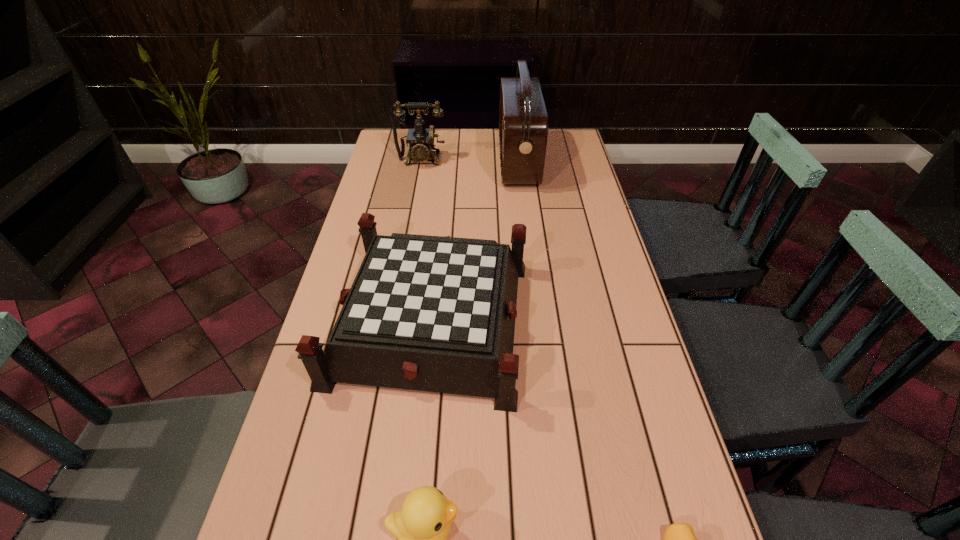
The image size is (960, 540). I want to click on the tallest object, so click(523, 121).

What are the coordinates of `the second tallest object` in the screenshot? It's located at (420, 140).

In order to click on the third shortest object in this screenshot , I will do `click(429, 313)`.

Identify the location of checkerboard. Image resolution: width=960 pixels, height=540 pixels. (429, 313).

Find the location of a particular element. The height and width of the screenshot is (540, 960). vacant space located 0.360m on the front panel of the tallest object is located at coordinates [403, 163].

This screenshot has width=960, height=540. I want to click on vacant space located on the front panel of the tallest object, so click(469, 163).

This screenshot has height=540, width=960. I want to click on free space located on the front panel of the tallest object, so click(444, 163).

Where is `free space located 0.290m on the rotary dial of the second tallest object`? The width and height of the screenshot is (960, 540). free space located 0.290m on the rotary dial of the second tallest object is located at coordinates (411, 218).

Identify the location of free region located on the back of the checkerboard. (444, 198).

The image size is (960, 540). Identify the location of radio receiver at the far edge. (523, 121).